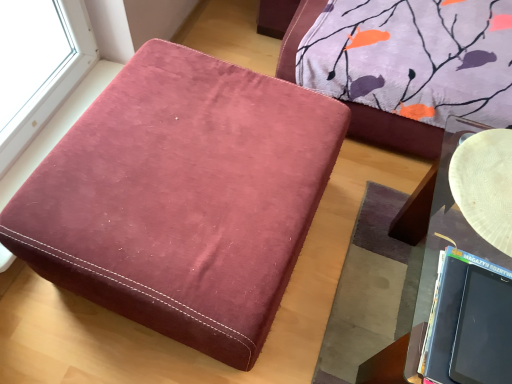
I want to click on vacant area on top of velvet-like burgundy ottoman at center (from a real-world perspective), so click(187, 146).